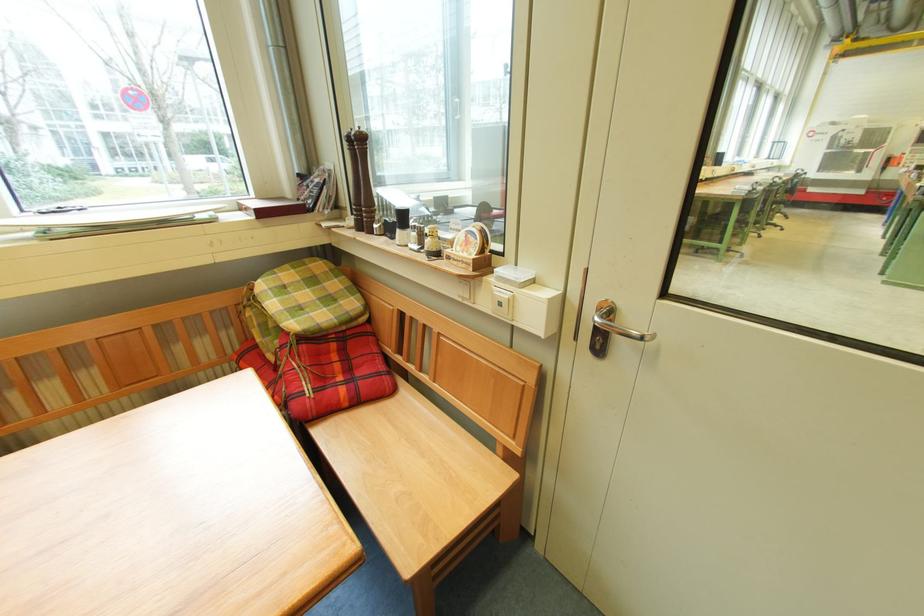
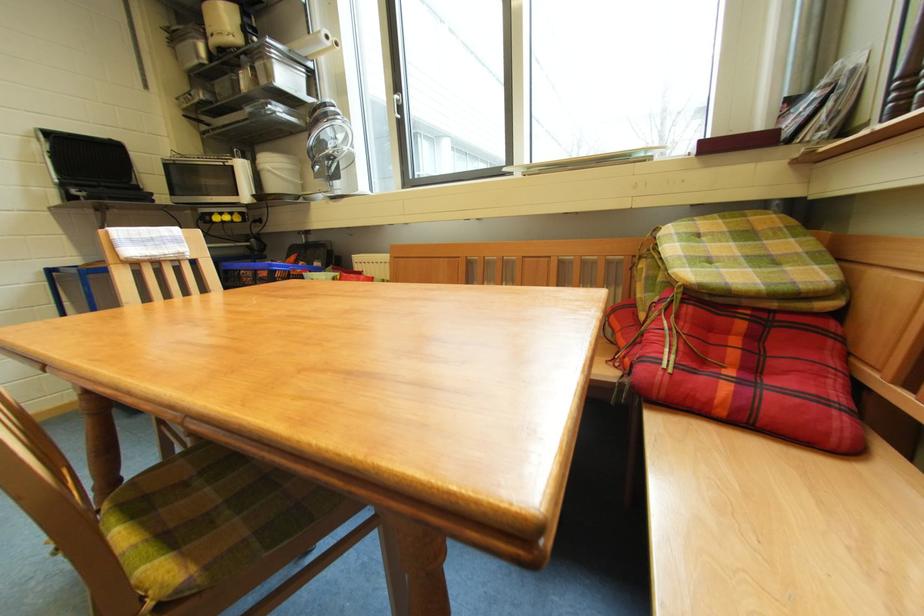
The point at (403, 397) is marked in the first image. Where is the corresponding point in the second image?

(864, 463)